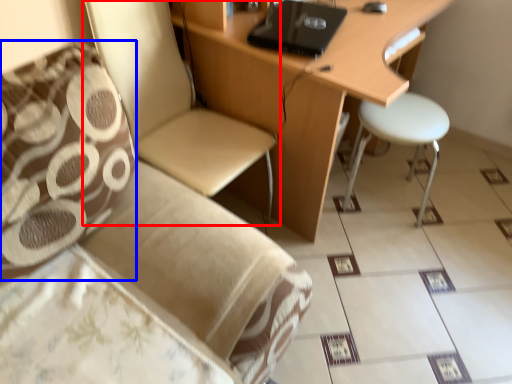
Question: Which object is closer to the camera taking this photo, chair (highlighted by a red box) or pillow (highlighted by a blue box)?

Choices:
 (A) chair
 (B) pillow

Answer: (B)